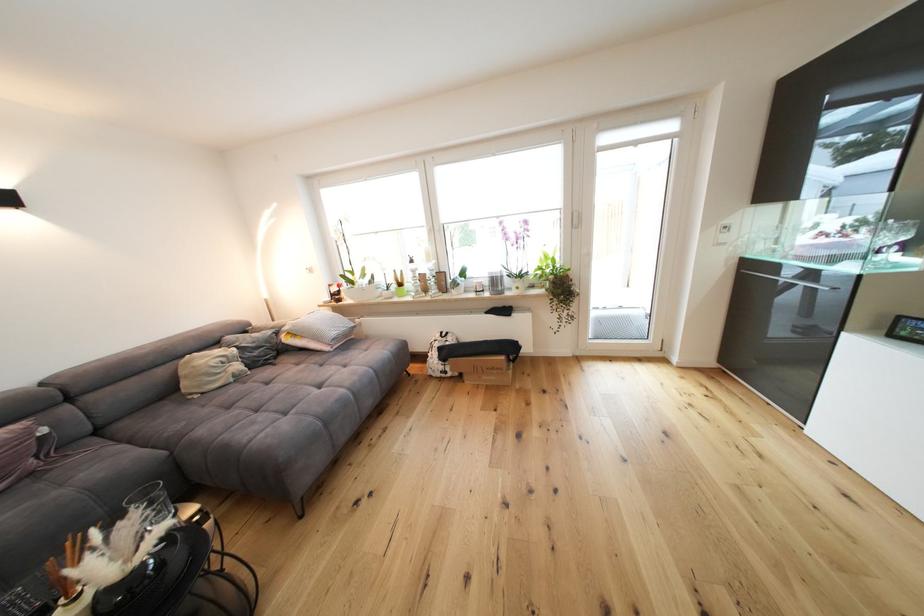
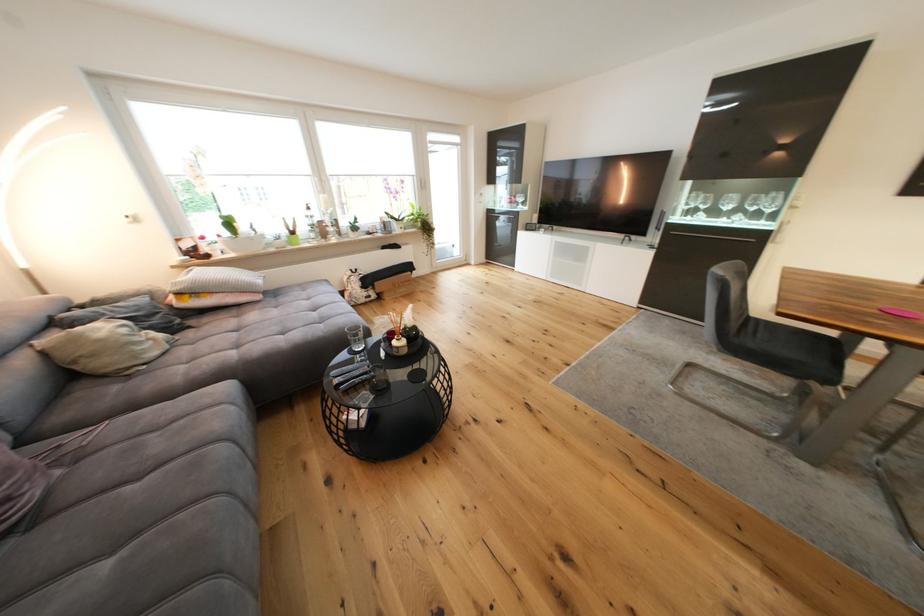
Locate, in the second image, the point that corresponds to point 448,369 in the first image.

(372, 296)